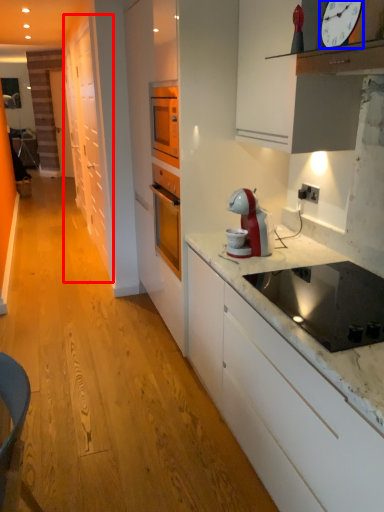
Question: Which of the following is the closest to the observer, cabinetry (highlighted by a red box) or clock (highlighted by a blue box)?

Choices:
 (A) cabinetry
 (B) clock

Answer: (B)